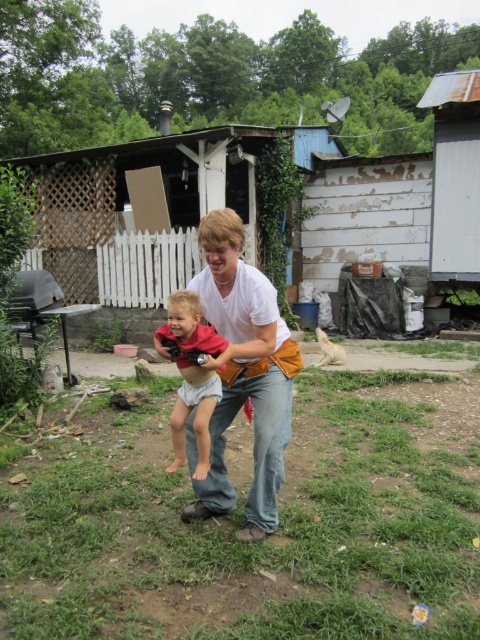
You are a photographer trying to capture a closeup of the white cotton shirt at center and the light gray cloth diaper at center. Which one should you focus on to ensure it appears clearer in the photo?

The white cotton shirt at center is closer to the viewer than the light gray cloth diaper at center, so focusing on it will ensure it appears clearer in the photo.

In the backyard scene, there is a man wearing a white cotton shirt at center and a child wearing a light gray cloth diaper at center. From the perspective of someone standing behind the man, which item is positioned to the left?

The light gray cloth diaper at center is to the left of the white cotton shirt at center from the observer standing behind the man.

Based on the coordinates provided, which object is located at point [244,374] in the image?

The white cotton shirt at center is located at point [244,374].